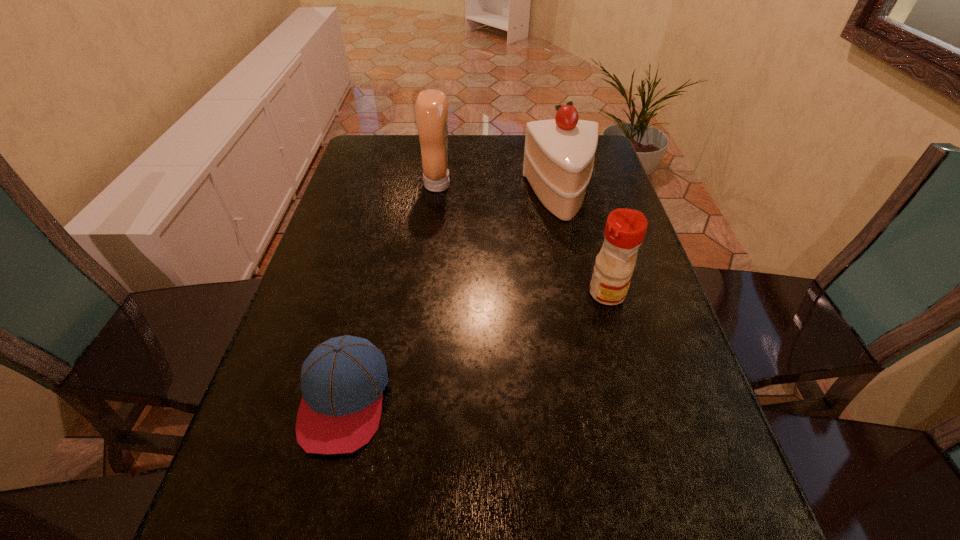
I want to click on the farther condiment, so click(431, 108).

The width and height of the screenshot is (960, 540). In order to click on the left condiment in this screenshot , I will do `click(431, 108)`.

What are the coordinates of `cake` in the screenshot? It's located at (559, 153).

In order to click on the nearer condiment in this screenshot , I will do `click(625, 229)`.

Locate an element on the screen. This screenshot has height=540, width=960. the shorter condiment is located at coordinates (625, 229).

Where is `the nearest object`? The height and width of the screenshot is (540, 960). the nearest object is located at coordinates (342, 381).

Find the location of a particular element. This screenshot has height=540, width=960. the shortest object is located at coordinates (342, 381).

What are the coordinates of `free spot located 0.090m on the label of the third object from right to left` in the screenshot? It's located at (482, 185).

At what (x,y) coordinates should I click in order to perform the action: click on free space located on the left of the cake. Please return your answer as a coordinate pair (x, y). This screenshot has width=960, height=540. Looking at the image, I should click on (406, 197).

Find the location of a particular element. vacant space positioned on the front of the third farthest object is located at coordinates (627, 363).